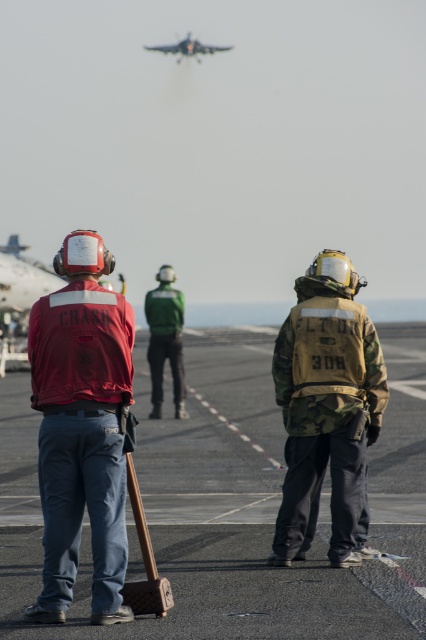
You are a deckhand on an aircraft carrier and need to locate two items for an emergency procedure. You see a camo fabric backpack at center and a green fabric jacket at center. Which item is located to the right of the other?

The camo fabric backpack at center is positioned on the right side of green fabric jacket at center, so the camo fabric backpack at center is to the right of the green fabric jacket at center.

You are a deck crew member on an aircraft carrier. You need to move the camo fabric backpack at center to a storage area. However, there is a metallic silver jet at upper center in your path. Can you safely move the backpack under the jet without it getting damaged?

The camo fabric backpack at center is not as tall as the metallic silver jet at upper center, so it can safely pass under the jet without causing damage.

You are a pilot on the aircraft carrier deck. You need to move from your current position to a point closer to the camera. Which of the two points, point 1 at coordinates point [340,504] or point 2 at coordinates point [160,45], should you choose?

You should choose point 1 at coordinates point [340,504] because it is closer to the camera than point 2 at coordinates point [160,45].